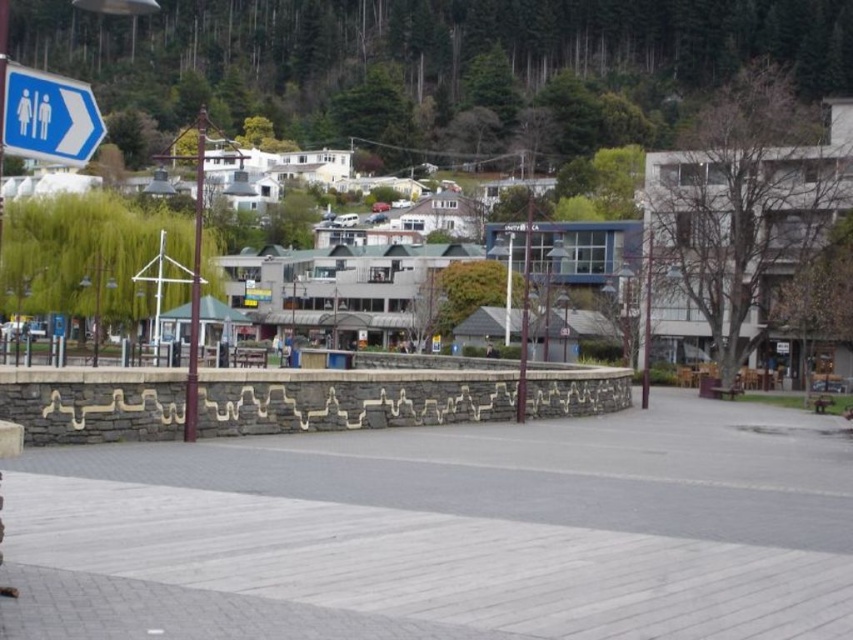
From the picture: Can you confirm if gray concrete pavement at center is thinner than blue plastic sign at upper left?

In fact, gray concrete pavement at center might be wider than blue plastic sign at upper left.

Locate an element on the screen. The height and width of the screenshot is (640, 853). gray concrete pavement at center is located at coordinates (474, 524).